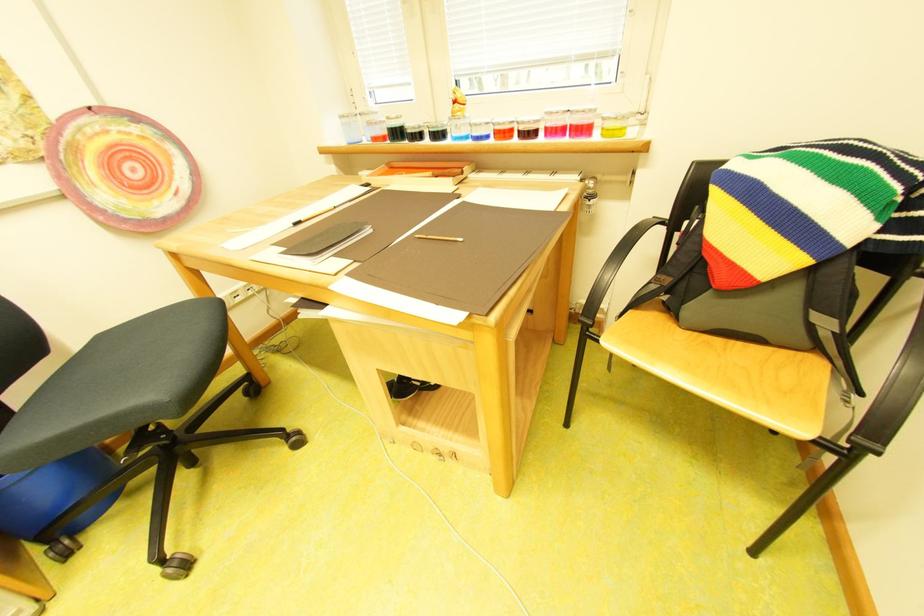
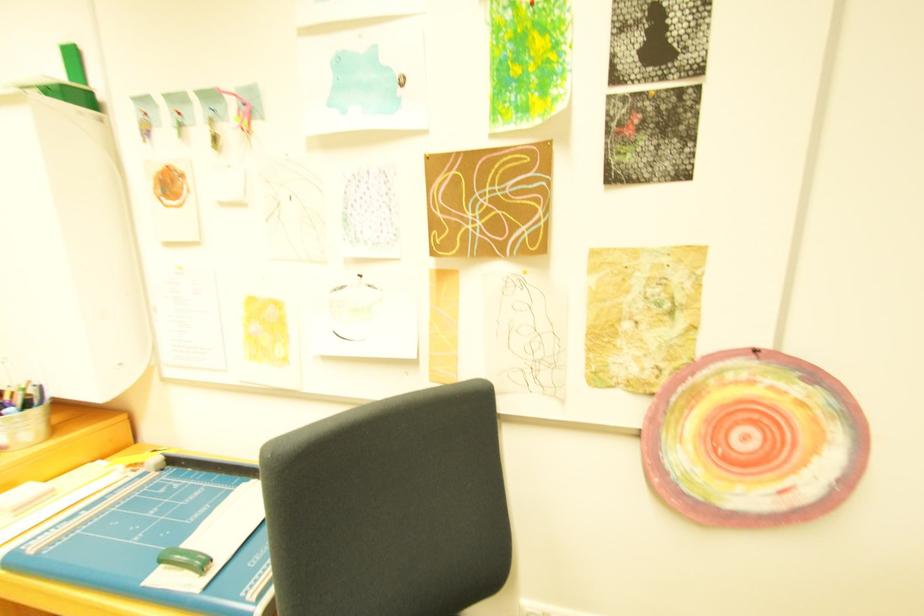
Question: The camera is either moving clockwise (left) or counter-clockwise (right) around the object. The first image is from the beginning of the video and the second image is from the end. Is the camera moving left or right when shooting the video?

Choices:
 (A) Left
 (B) Right

Answer: (B)